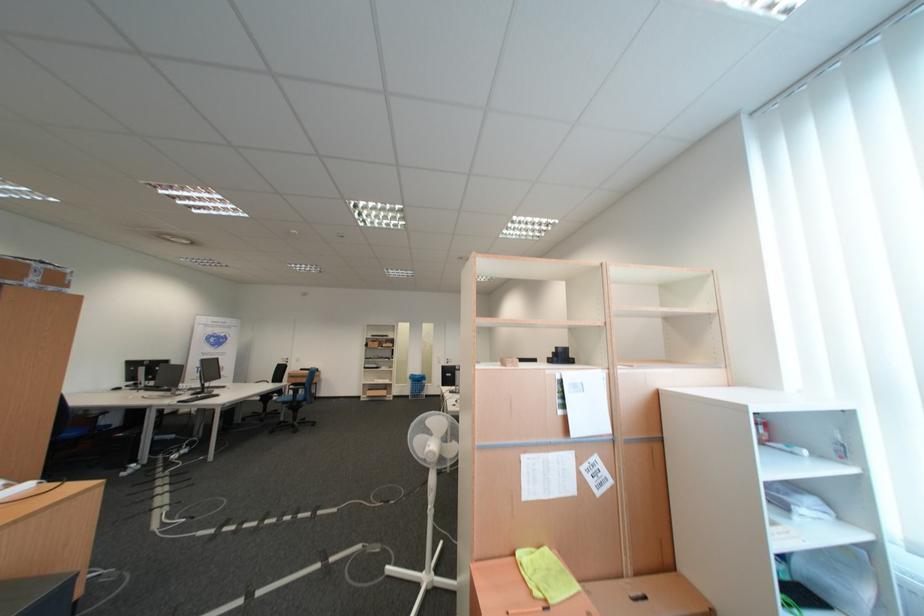
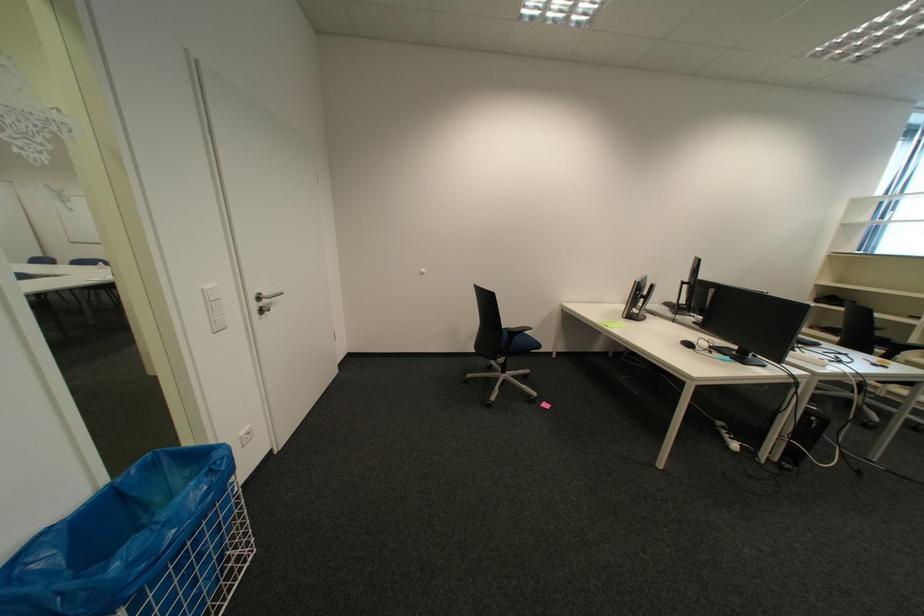
Find the pixel in the second image that matches point (458, 362) in the first image.

(266, 307)